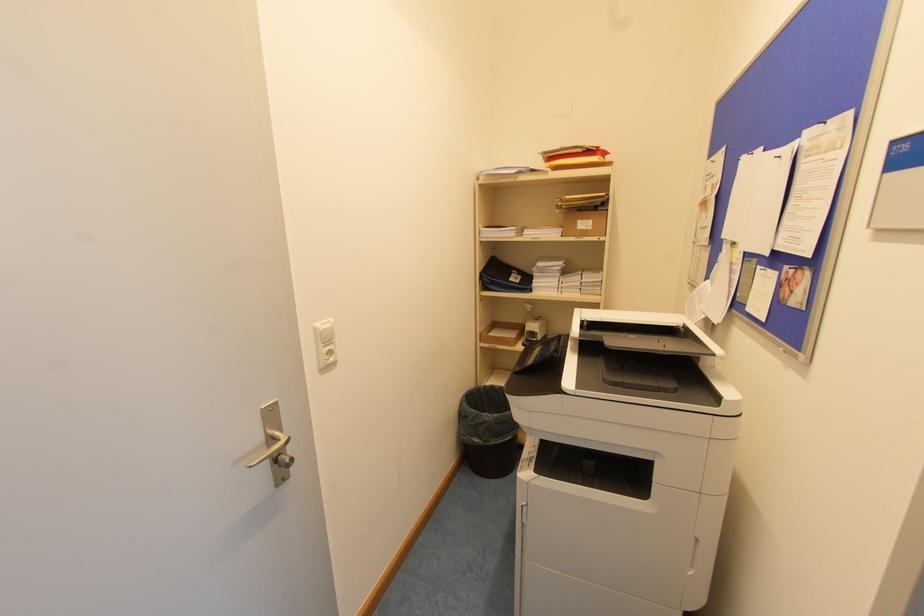
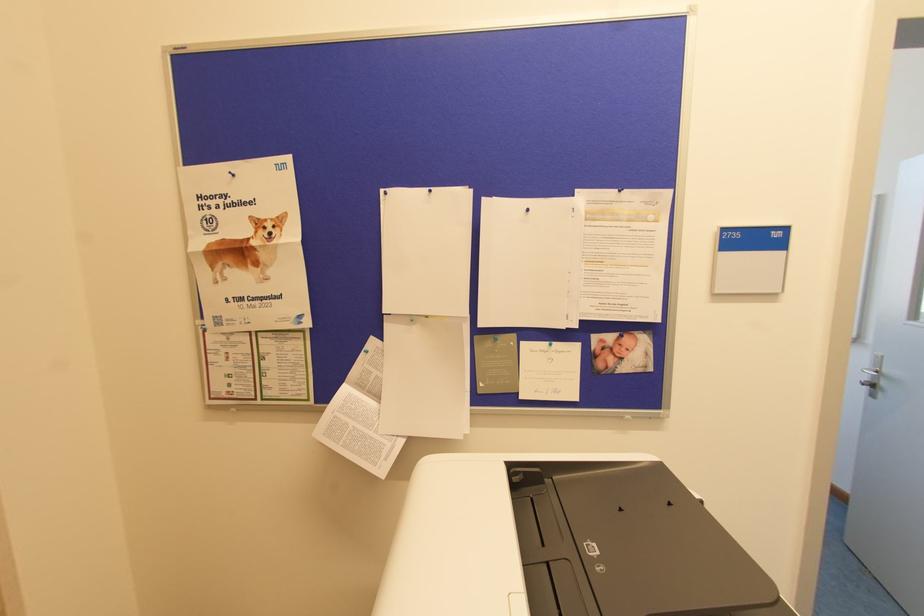
Where in the second image is the point corresponding to the point at 751,153 from the first image?

(430, 191)